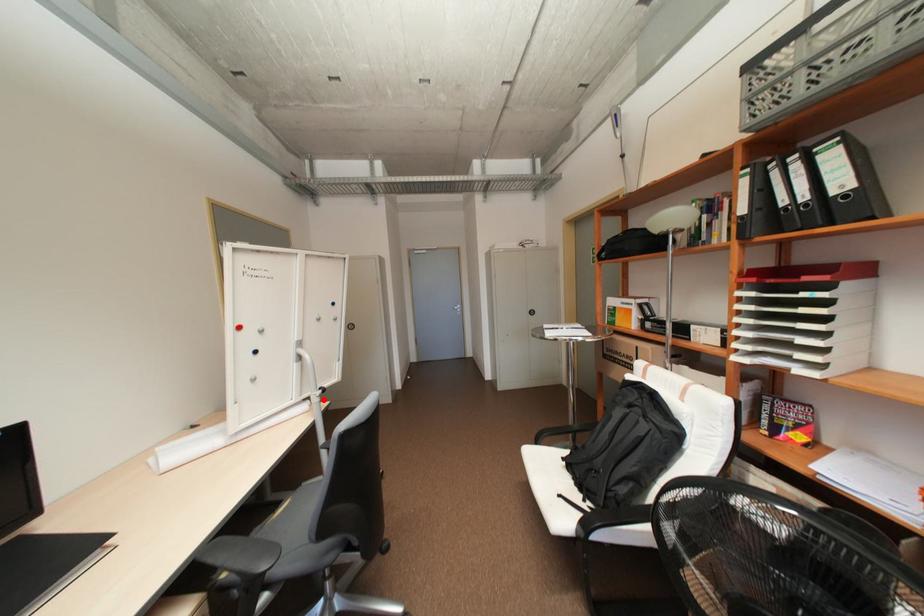
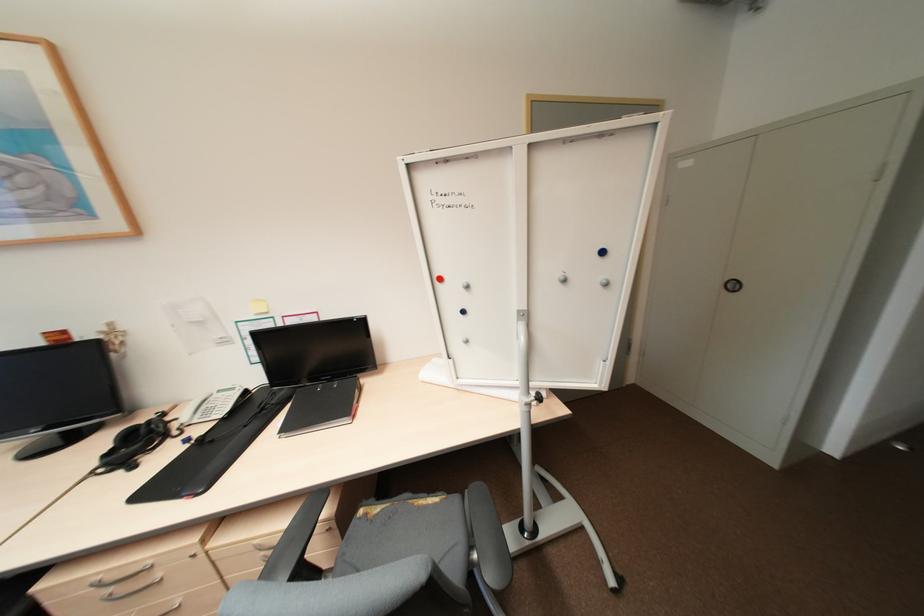
In the second image, find the point that corresponds to the highlighted location in the first image.

(531, 408)